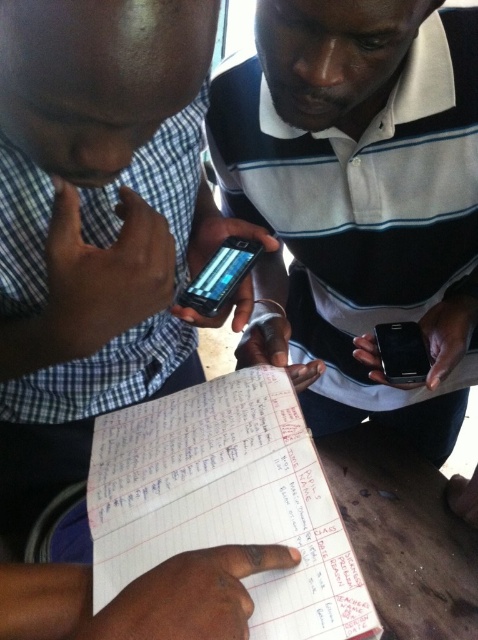
Question: Is black striped shirt at center closer to camera compared to black glossy smartphone at center?

Choices:
 (A) no
 (B) yes

Answer: (B)

Question: Is white paper at center wider than satin black smartphone at center?

Choices:
 (A) no
 (B) yes

Answer: (B)

Question: Which of the following is the farthest from the observer?

Choices:
 (A) black striped shirt at center
 (B) black glossy smartphone at center

Answer: (B)

Question: Which point is closer to the camera taking this photo?

Choices:
 (A) 202,444
 (B) 201,273
 (C) 258,280
 (D) 427,358

Answer: (A)

Question: From the image, what is the correct spatial relationship of black striped shirt at center in relation to satin black smartphone at center?

Choices:
 (A) below
 (B) above

Answer: (A)

Question: Among these objects, which one is nearest to the camera?

Choices:
 (A) black striped shirt at center
 (B) white paper at center
 (C) satin black smartphone at center

Answer: (A)